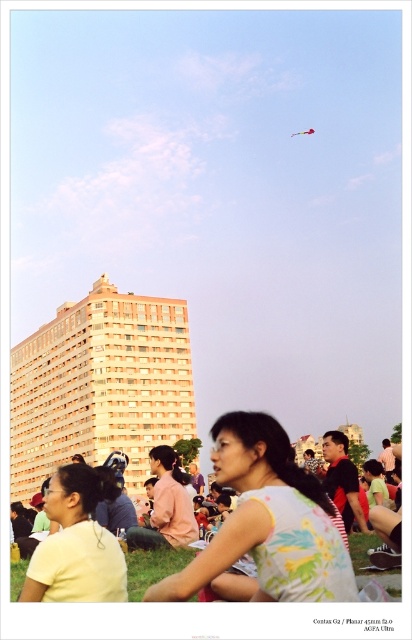
Question: In this image, where is floral printed dress at center located relative to multicolored fabric kite at upper center?

Choices:
 (A) left
 (B) right

Answer: (A)

Question: Observing the image, what is the correct spatial positioning of floral printed dress at center in reference to yellow matte shirt at lower left?

Choices:
 (A) above
 (B) below

Answer: (A)

Question: Considering the real-world distances, which object is closest to the multicolored fabric kite at upper center?

Choices:
 (A) floral printed dress at center
 (B) yellow matte shirt at lower left

Answer: (B)

Question: Which object is positioned farthest from the multicolored fabric kite at upper center?

Choices:
 (A) green grass at lower center
 (B) floral printed dress at center
 (C) yellow matte shirt at lower left

Answer: (B)

Question: Among these points, which one is farthest from the camera?

Choices:
 (A) (51, 579)
 (B) (308, 129)
 (C) (248, 433)

Answer: (B)

Question: Can you confirm if yellow matte shirt at lower left is positioned above multicolored fabric kite at upper center?

Choices:
 (A) yes
 (B) no

Answer: (B)